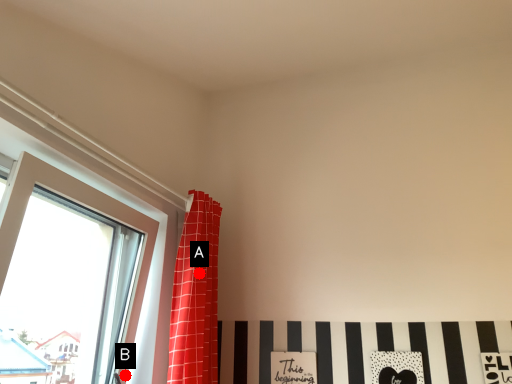
Question: Two points are circled on the image, labeled by A and B beside each circle. Which point is closer to the camera?

Choices:
 (A) A is closer
 (B) B is closer

Answer: (B)